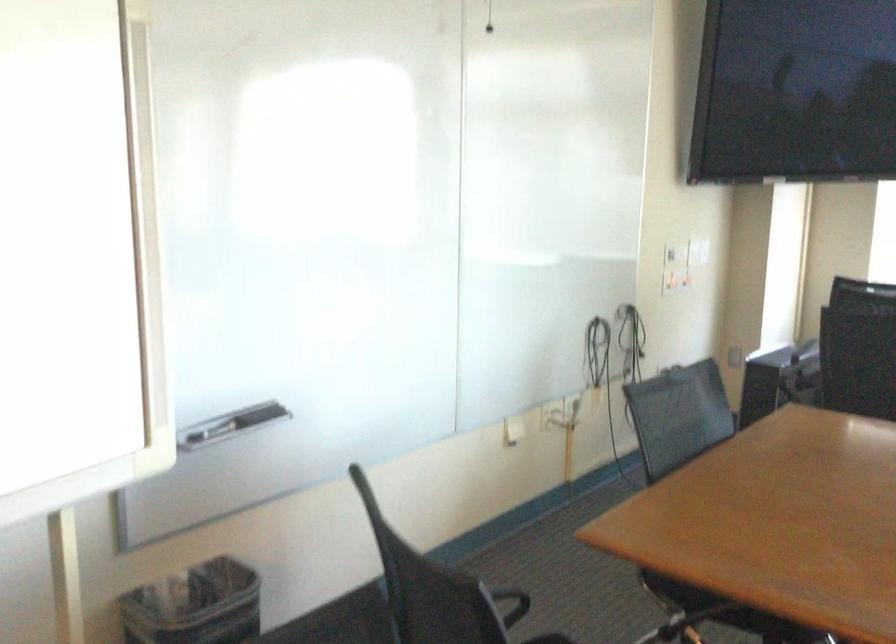
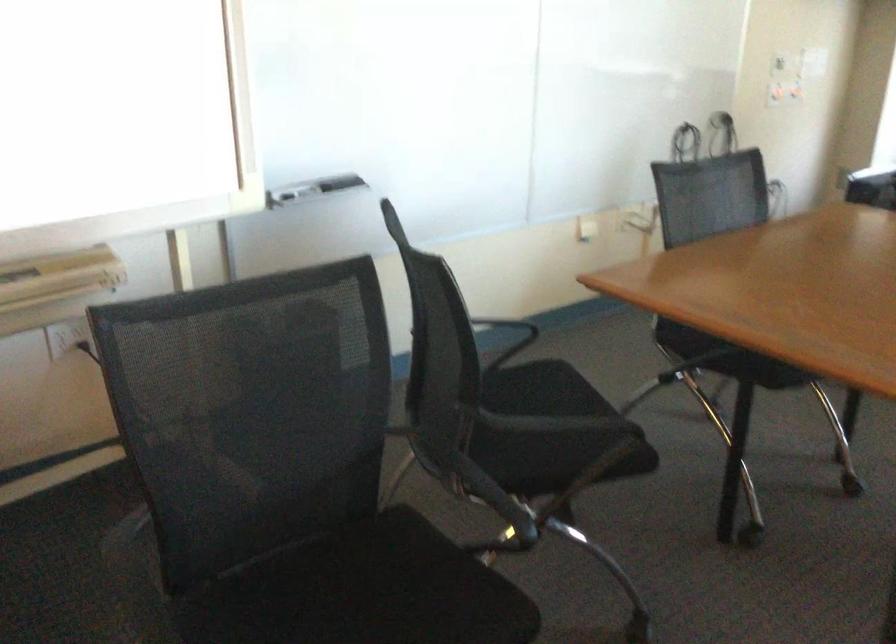
Locate, in the second image, the point that corresponds to (x=220, y=431) in the first image.

(312, 189)